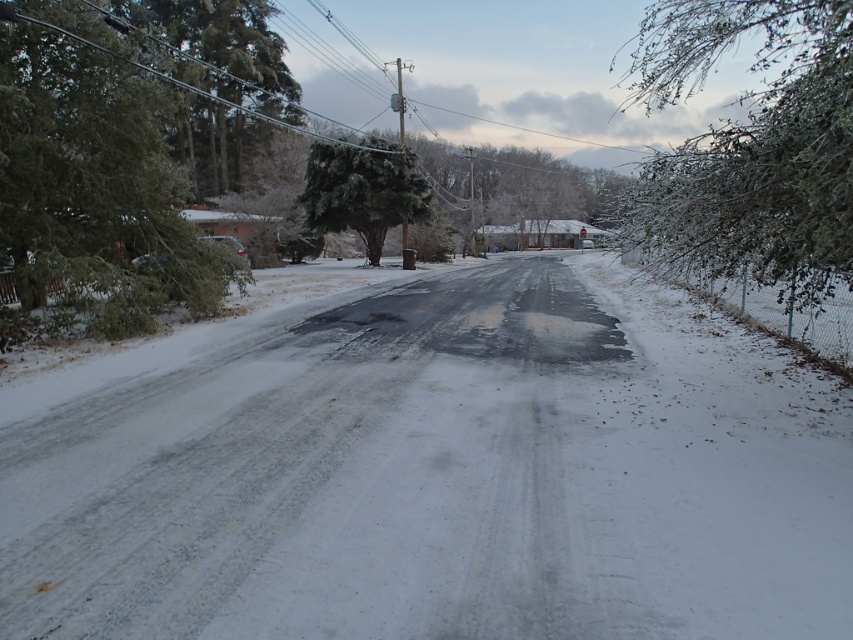
Question: Among these points, which one is nearest to the camera?

Choices:
 (A) (184, 60)
 (B) (706, 40)
 (C) (706, 552)
 (D) (378, 186)

Answer: (C)

Question: Which of the following is the farthest from the observer?

Choices:
 (A) (61, 195)
 (B) (375, 189)
 (C) (782, 125)

Answer: (B)

Question: Does white matte snow at center appear on the right side of green frosted tree at left?

Choices:
 (A) no
 (B) yes

Answer: (B)

Question: Estimate the real-world distances between objects in this image. Which object is closer to the white matte snow at center?

Choices:
 (A) green matte tree at center
 (B) green frosted tree at left
 (C) snow-covered branches at right

Answer: (B)

Question: Can you confirm if white matte snow at center is wider than green frosted tree at left?

Choices:
 (A) yes
 (B) no

Answer: (B)

Question: Does white matte snow at center have a larger size compared to snow-covered branches at right?

Choices:
 (A) no
 (B) yes

Answer: (A)